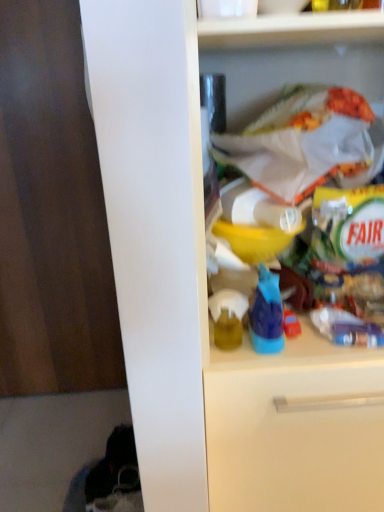
Question: Considering the relative sizes of blue plastic bottle at center and dark wood door at left in the image provided, is blue plastic bottle at center wider than dark wood door at left?

Choices:
 (A) yes
 (B) no

Answer: (A)

Question: Is blue plastic bottle at center at the right side of dark wood door at left?

Choices:
 (A) yes
 (B) no

Answer: (A)

Question: Does blue plastic bottle at center come in front of dark wood door at left?

Choices:
 (A) yes
 (B) no

Answer: (A)

Question: Can you confirm if blue plastic bottle at center is positioned to the left of dark wood door at left?

Choices:
 (A) no
 (B) yes

Answer: (A)

Question: From a real-world perspective, is blue plastic bottle at center located higher than dark wood door at left?

Choices:
 (A) yes
 (B) no

Answer: (A)

Question: From the image's perspective, is dark wood door at left positioned above or below matte yellow bottle at center?

Choices:
 (A) above
 (B) below

Answer: (A)

Question: Is dark wood door at left taller or shorter than matte yellow bottle at center?

Choices:
 (A) tall
 (B) short

Answer: (A)

Question: Is dark wood door at left spatially inside matte yellow bottle at center, or outside of it?

Choices:
 (A) inside
 (B) outside

Answer: (B)

Question: Is dark wood door at left wider or thinner than matte yellow bottle at center?

Choices:
 (A) wide
 (B) thin

Answer: (B)

Question: Considering the positions of point (292, 172) and point (278, 295), is point (292, 172) closer or farther from the camera than point (278, 295)?

Choices:
 (A) farther
 (B) closer

Answer: (A)

Question: In the image, is white plastic bag at upper right on the left side or the right side of blue plastic bottle at center?

Choices:
 (A) right
 (B) left

Answer: (A)

Question: From the image's perspective, is white plastic bag at upper right located above or below blue plastic bottle at center?

Choices:
 (A) above
 (B) below

Answer: (A)

Question: Is white plastic bag at upper right wider or thinner than blue plastic bottle at center?

Choices:
 (A) wide
 (B) thin

Answer: (A)

Question: Is blue plastic bottle at center inside or outside of matte yellow bottle at center?

Choices:
 (A) outside
 (B) inside

Answer: (A)

Question: Is blue plastic bottle at center in front of or behind matte yellow bottle at center in the image?

Choices:
 (A) front
 (B) behind

Answer: (A)